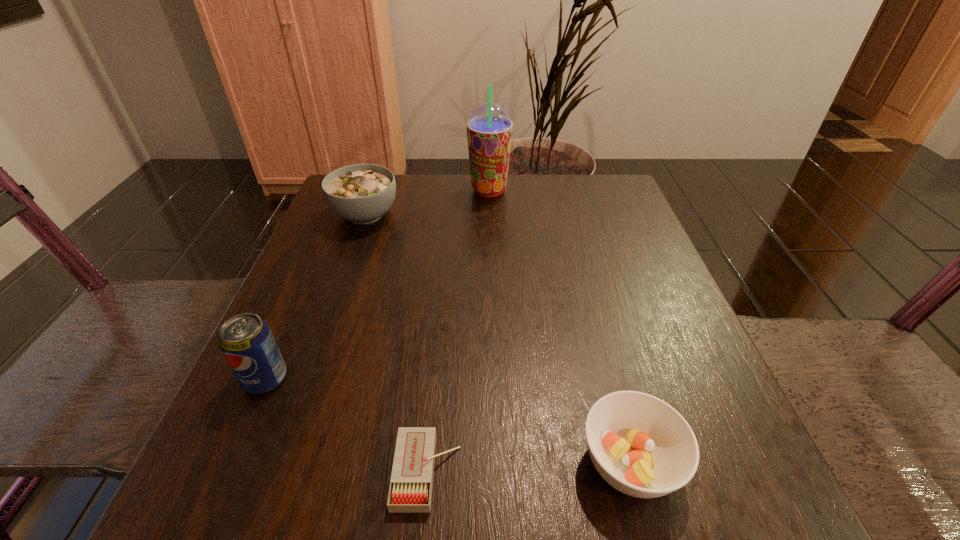
At what (x,y) coordinates should I click in order to perform the action: click on object that is at the far left corner. Please return your answer as a coordinate pair (x, y). Looking at the image, I should click on (361, 193).

The height and width of the screenshot is (540, 960). In order to click on object situated at the near right corner in this screenshot , I will do `click(640, 445)`.

Locate an element on the screen. The image size is (960, 540). free space at the far edge of the desktop is located at coordinates (443, 179).

The width and height of the screenshot is (960, 540). I want to click on blank space at the near edge, so click(513, 524).

In the image, there is a desktop. Identify the location of free space at the left edge. (311, 394).

Image resolution: width=960 pixels, height=540 pixels. What are the coordinates of `vacant region at the right edge of the desktop` in the screenshot? It's located at (657, 286).

I want to click on free space at the near left corner of the desktop, so click(316, 484).

Locate an element on the screen. The width and height of the screenshot is (960, 540). vacant space at the far right corner of the desktop is located at coordinates (587, 224).

In the image, there is a desktop. Identify the location of vacant space at the near right corner. The height and width of the screenshot is (540, 960). (692, 498).

Find the location of `free space between the rightmost object and the matchbox`. free space between the rightmost object and the matchbox is located at coordinates (528, 467).